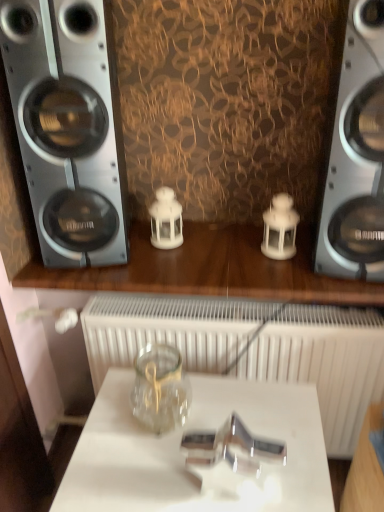
The image size is (384, 512). Find the location of `free point to the right of transparent glass jar at center`. free point to the right of transparent glass jar at center is located at coordinates (224, 403).